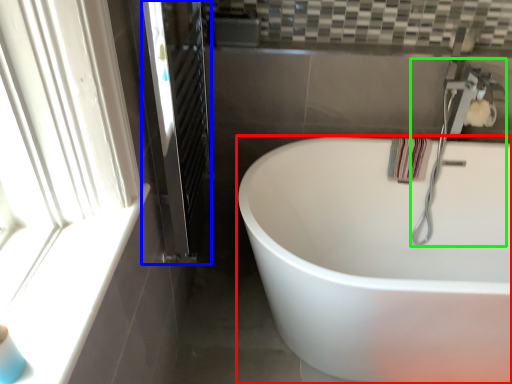
Question: Considering the real-world distances, which object is closest to bathtub (highlighted by a red box)? screen door (highlighted by a blue box) or faucet (highlighted by a green box).

Choices:
 (A) screen door
 (B) faucet

Answer: (B)